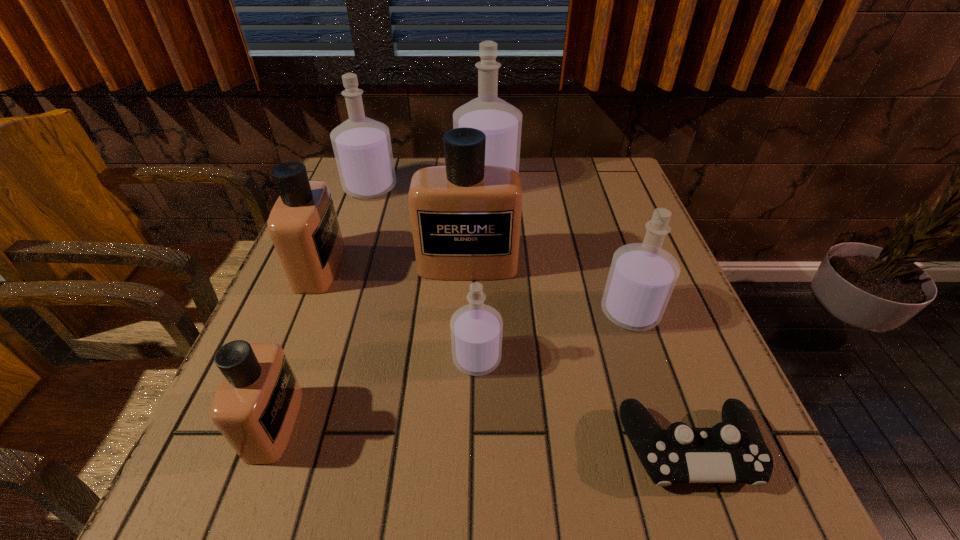
You are a GUI agent. You are given a task and a screenshot of the screen. Output one action in this format:
    pyautogui.click(x=<x>, y=<y>)
    Task: Click on the free region at the right edge of the desktop
    This screenshot has width=960, height=540.
    Given the screenshot: What is the action you would take?
    pyautogui.click(x=664, y=408)

This screenshot has width=960, height=540. In the image, there is a desktop. Identify the location of free space at the far left corner. (342, 189).

In the image, there is a desktop. Find the location of `free region at the near left corner`. free region at the near left corner is located at coordinates (290, 501).

This screenshot has height=540, width=960. I want to click on free region at the far right corner of the desktop, so click(x=598, y=198).

Where is `empty space that is in between the rightmost purple perfume and the black control`? Image resolution: width=960 pixels, height=540 pixels. empty space that is in between the rightmost purple perfume and the black control is located at coordinates (660, 380).

Identify the location of free space between the sixth farthest object and the nearest beige perfume. (375, 391).

Find the location of a particular element. free spot between the tallest object and the nearest perfume is located at coordinates (381, 303).

Locate an element on the screen. vacant space that is in between the rightmost beige perfume and the shortest object is located at coordinates (579, 356).

In order to click on free space that is in between the second nearest purple perfume and the sixth farthest object in this screenshot , I will do `click(554, 335)`.

Where is `vacant region between the second smallest beige perfume and the control`? The height and width of the screenshot is (540, 960). vacant region between the second smallest beige perfume and the control is located at coordinates (505, 357).